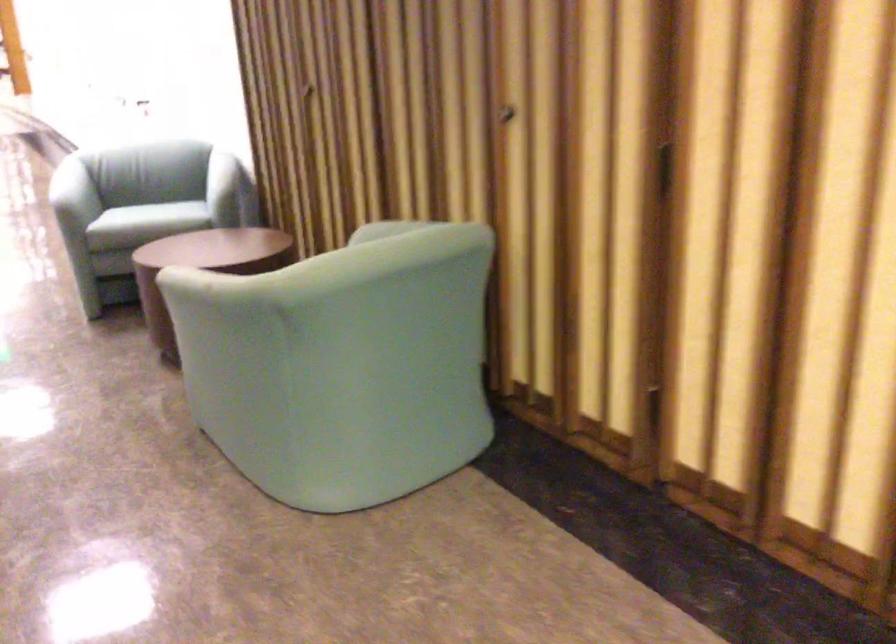
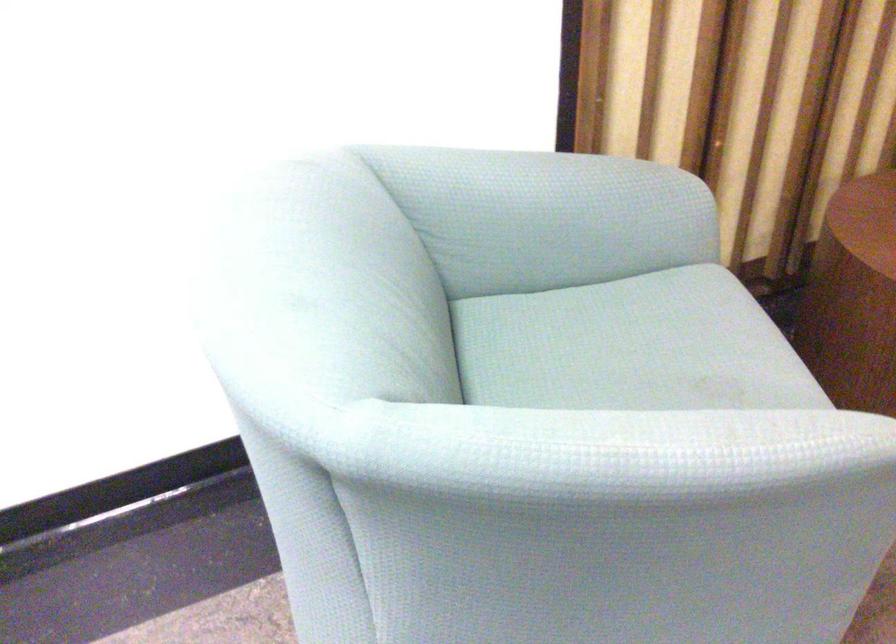
Where in the second image is the point corresponding to (x=197, y=163) from the first image?

(545, 216)